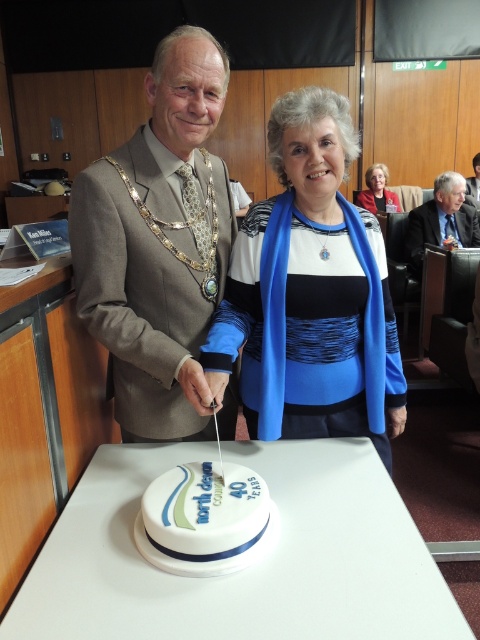
Does white glossy table at center have a larger size compared to blue suit at center?

Actually, white glossy table at center might be smaller than blue suit at center.

Does white glossy table at center have a greater height compared to blue suit at center?

No.

Where is `white glossy table at center`? The width and height of the screenshot is (480, 640). white glossy table at center is located at coordinates (249, 566).

Does blue suit at center have a lesser width compared to gray suit at center?

No.

Can you confirm if blue suit at center is taller than gray suit at center?

Yes.

Is point (436, 243) closer to camera compared to point (476, 184)?

Yes, point (436, 243) is in front of point (476, 184).

Find the location of a particular element. blue suit at center is located at coordinates (442, 220).

Does blue fabric scarf at center appear over white fondant cake at center?

Correct, blue fabric scarf at center is located above white fondant cake at center.

Find the location of a particular element. The width and height of the screenshot is (480, 640). blue fabric scarf at center is located at coordinates (310, 292).